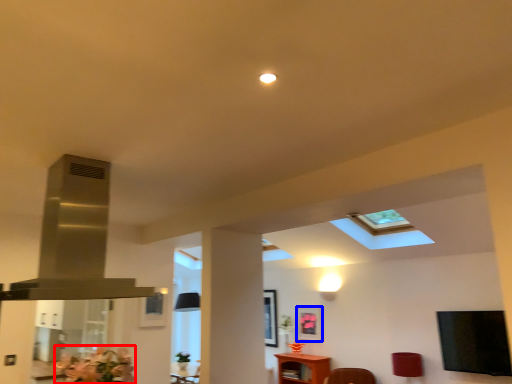
Question: Among these objects, which one is nearest to the camera, flower (highlighted by a red box) or picture frame (highlighted by a blue box)?

Choices:
 (A) flower
 (B) picture frame

Answer: (A)